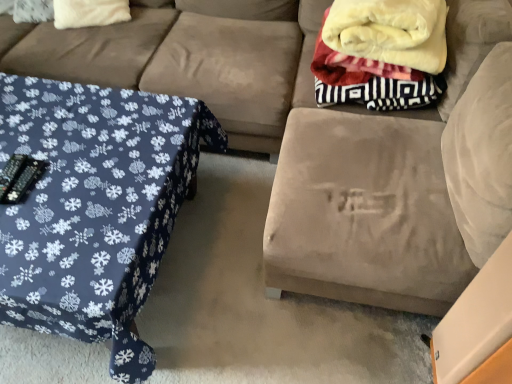
You are a GUI agent. You are given a task and a screenshot of the screen. Output one action in this format:
    pyautogui.click(x=<x>, y=<y>)
    Task: Click on the vacant space situated above blue fabric table at left (from a real-world perspective)
    The height and width of the screenshot is (384, 512).
    Given the screenshot: What is the action you would take?
    pyautogui.click(x=72, y=166)